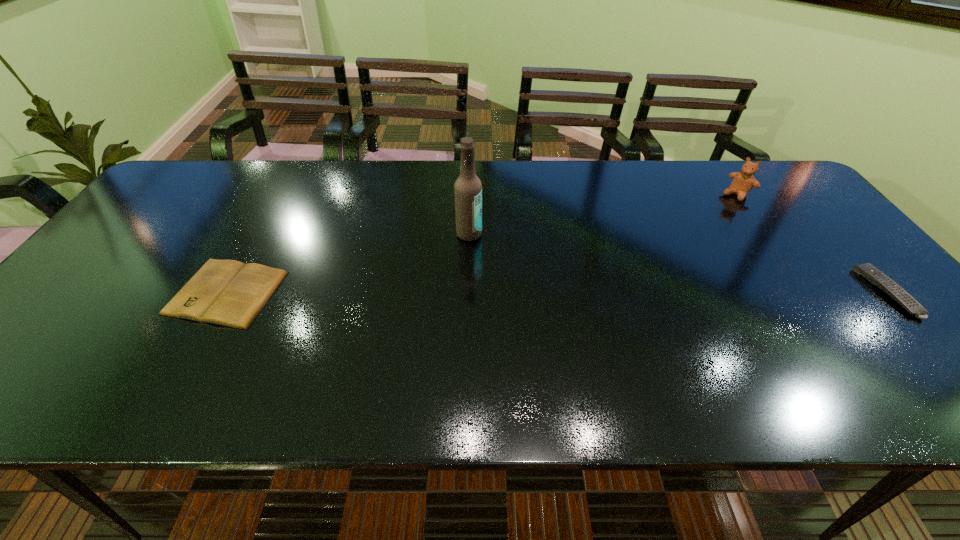
Identify the location of free location at the near edge. The height and width of the screenshot is (540, 960). (557, 347).

In order to click on vacant region at the left edge in this screenshot , I will do `click(175, 237)`.

Where is `free space at the far right corner of the desktop`? free space at the far right corner of the desktop is located at coordinates (770, 200).

Identify the location of empty location between the tallest object and the remote control. (678, 263).

Where is `empty space that is in between the third nearest object and the book`? This screenshot has height=540, width=960. empty space that is in between the third nearest object and the book is located at coordinates (348, 263).

Identify the location of free space between the beer bottle and the teddy bear. The image size is (960, 540). (603, 214).

Find the location of `vacant space that's between the farthest object and the book`. vacant space that's between the farthest object and the book is located at coordinates (482, 244).

I want to click on free space between the leftmost object and the farthest object, so click(x=482, y=244).

What are the coordinates of `vacant area between the tallest object and the third object from left to right` in the screenshot? It's located at pos(603,214).

Where is `free spot between the farthest object and the book`? free spot between the farthest object and the book is located at coordinates (482, 244).